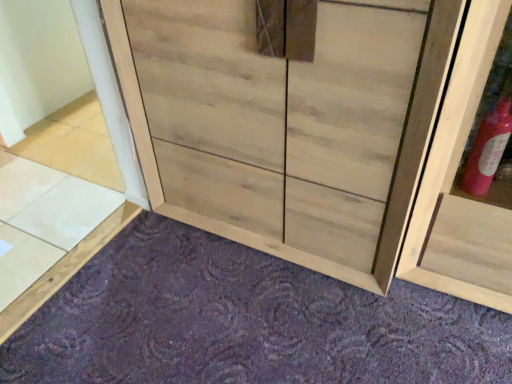
Question: Is light brown wood tile at lower left bigger or smaller than purple carpet at lower center?

Choices:
 (A) small
 (B) big

Answer: (A)

Question: From the image's perspective, relative to purple carpet at lower center, is light brown wood tile at lower left above or below?

Choices:
 (A) above
 (B) below

Answer: (A)

Question: Which of these objects is positioned closest to the light brown wood tile at lower left?

Choices:
 (A) natural wood cupboard at center
 (B) purple carpet at lower center

Answer: (A)

Question: Which of these objects is positioned closest to the purple carpet at lower center?

Choices:
 (A) light brown wood tile at lower left
 (B) natural wood cupboard at center

Answer: (B)